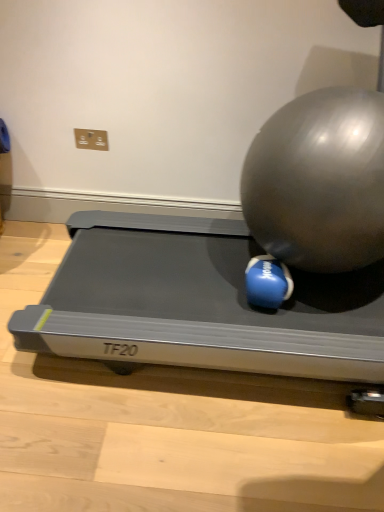
Question: Can you confirm if blue rubber ball at center, marked as the 1th ball in a left-to-right arrangement, is wider than shiny metallic ball at center right, arranged as the second ball when viewed from the left?

Choices:
 (A) yes
 (B) no

Answer: (B)

Question: Would you say blue rubber ball at center, marked as the 1th ball in a left-to-right arrangement, contains shiny metallic ball at center right, arranged as the second ball when viewed from the left?

Choices:
 (A) no
 (B) yes

Answer: (A)

Question: Is blue rubber ball at center, positioned as the second ball in right-to-left order, next to shiny metallic ball at center right, arranged as the second ball when viewed from the left?

Choices:
 (A) no
 (B) yes

Answer: (A)

Question: Does blue rubber ball at center, marked as the 1th ball in a left-to-right arrangement, have a smaller size compared to shiny metallic ball at center right, which is counted as the 1th ball, starting from the right?

Choices:
 (A) yes
 (B) no

Answer: (A)

Question: Is blue rubber ball at center, marked as the 1th ball in a left-to-right arrangement, looking in the opposite direction of shiny metallic ball at center right, arranged as the second ball when viewed from the left?

Choices:
 (A) yes
 (B) no

Answer: (A)

Question: Considering the relative sizes of blue rubber ball at center, positioned as the second ball in right-to-left order, and shiny metallic ball at center right, which is counted as the 1th ball, starting from the right, in the image provided, is blue rubber ball at center, positioned as the second ball in right-to-left order, bigger than shiny metallic ball at center right, which is counted as the 1th ball, starting from the right,?

Choices:
 (A) no
 (B) yes

Answer: (A)

Question: Is shiny metallic ball at center right, arranged as the second ball when viewed from the left, closer to the viewer compared to silver metallic treadmill at center?

Choices:
 (A) yes
 (B) no

Answer: (A)

Question: Does shiny metallic ball at center right, which is counted as the 1th ball, starting from the right, have a lesser height compared to silver metallic treadmill at center?

Choices:
 (A) no
 (B) yes

Answer: (A)

Question: Does shiny metallic ball at center right, arranged as the second ball when viewed from the left, have a larger size compared to silver metallic treadmill at center?

Choices:
 (A) yes
 (B) no

Answer: (A)

Question: Are shiny metallic ball at center right, which is counted as the 1th ball, starting from the right, and silver metallic treadmill at center far apart?

Choices:
 (A) yes
 (B) no

Answer: (B)

Question: Considering the relative sizes of shiny metallic ball at center right, which is counted as the 1th ball, starting from the right, and silver metallic treadmill at center in the image provided, is shiny metallic ball at center right, which is counted as the 1th ball, starting from the right, wider than silver metallic treadmill at center?

Choices:
 (A) no
 (B) yes

Answer: (A)

Question: From the image's perspective, is shiny metallic ball at center right, arranged as the second ball when viewed from the left, beneath silver metallic treadmill at center?

Choices:
 (A) no
 (B) yes

Answer: (A)

Question: Considering the relative sizes of silver metallic treadmill at center and blue rubber ball at center, positioned as the second ball in right-to-left order, in the image provided, is silver metallic treadmill at center wider than blue rubber ball at center, positioned as the second ball in right-to-left order,?

Choices:
 (A) yes
 (B) no

Answer: (A)